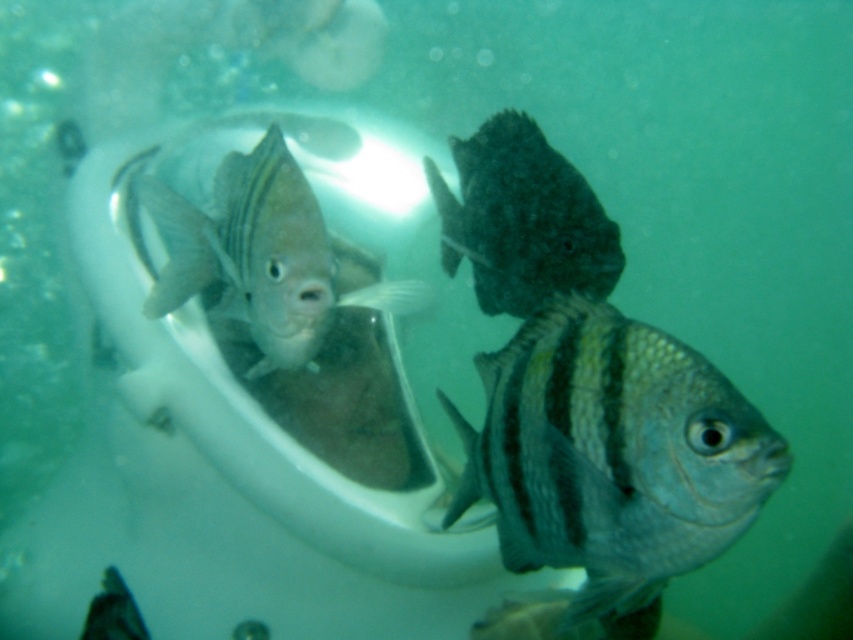
Is the position of shiny silver fish at center less distant than that of dark matte fish at center?

Yes, it is.

Between point (247, 305) and point (451, 275), which one is positioned behind?

Point (451, 275)

You are a GUI agent. You are given a task and a screenshot of the screen. Output one action in this format:
    pyautogui.click(x=<x>, y=<y>)
    Task: Click on the shiny silver fish at center
    The width and height of the screenshot is (853, 640).
    Given the screenshot: What is the action you would take?
    pyautogui.click(x=265, y=257)

Who is shorter, dark matte fish at center or shiny silver fish at lower left?

shiny silver fish at lower left is shorter.

Does dark matte fish at center appear on the left side of shiny silver fish at lower left?

No, dark matte fish at center is not to the left of shiny silver fish at lower left.

Image resolution: width=853 pixels, height=640 pixels. In order to click on dark matte fish at center in this screenshot , I will do `click(521, 220)`.

Identify the location of dark matte fish at center. (521, 220).

Describe the element at coordinates (612, 454) in the screenshot. I see `shiny metallic fish at center` at that location.

Between shiny metallic fish at center and dark matte fish at center, which one is positioned higher?

dark matte fish at center

Is point (642, 518) closer to camera compared to point (587, 289)?

Yes.

You are a GUI agent. You are given a task and a screenshot of the screen. Output one action in this format:
    pyautogui.click(x=<x>, y=<y>)
    Task: Click on the shiny metallic fish at center
    
    Given the screenshot: What is the action you would take?
    pyautogui.click(x=612, y=454)